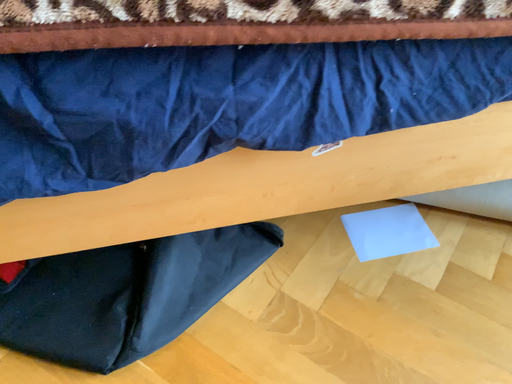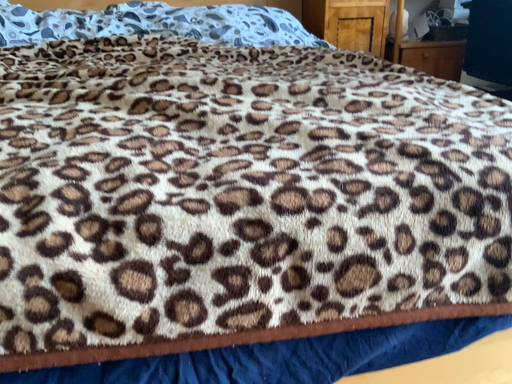
Question: Which way did the camera rotate in the video?

Choices:
 (A) rotated downward
 (B) rotated upward

Answer: (B)